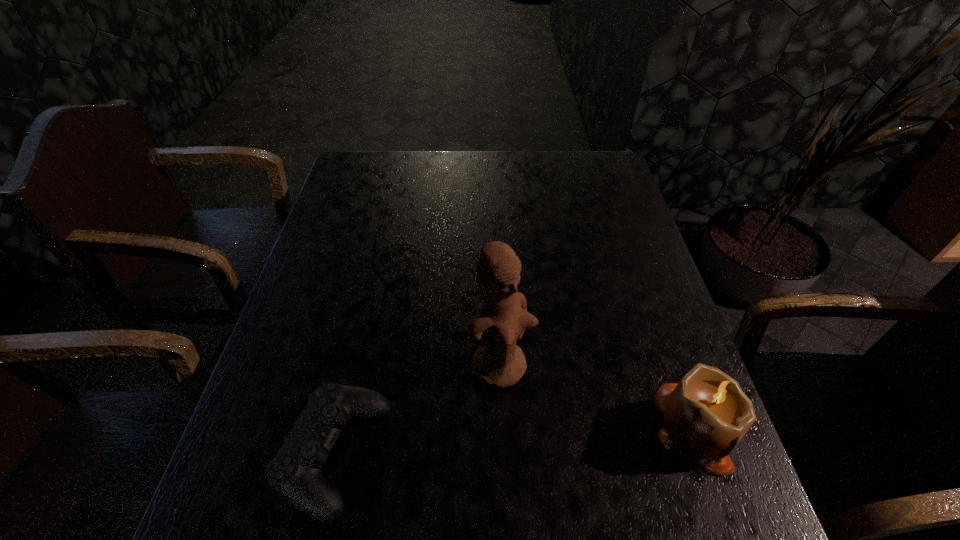
Where is `free location that satisfies the following two spatial constraints: 1. on the back side of the third shortest object; 2. on the left side of the second shortest object`? The width and height of the screenshot is (960, 540). free location that satisfies the following two spatial constraints: 1. on the back side of the third shortest object; 2. on the left side of the second shortest object is located at coordinates (340, 427).

Where is `vacant area in the image that satisfies the following two spatial constraints: 1. on the front side of the candle; 2. on the right side of the figurine`? vacant area in the image that satisfies the following two spatial constraints: 1. on the front side of the candle; 2. on the right side of the figurine is located at coordinates (502, 427).

Where is `blank area in the image that satisfies the following two spatial constraints: 1. on the front side of the shortest object; 2. on the left side of the third tallest object`? blank area in the image that satisfies the following two spatial constraints: 1. on the front side of the shortest object; 2. on the left side of the third tallest object is located at coordinates (313, 456).

Identify the location of vacant area that satisfies the following two spatial constraints: 1. on the back side of the rightmost object; 2. on the left side of the control. (340, 427).